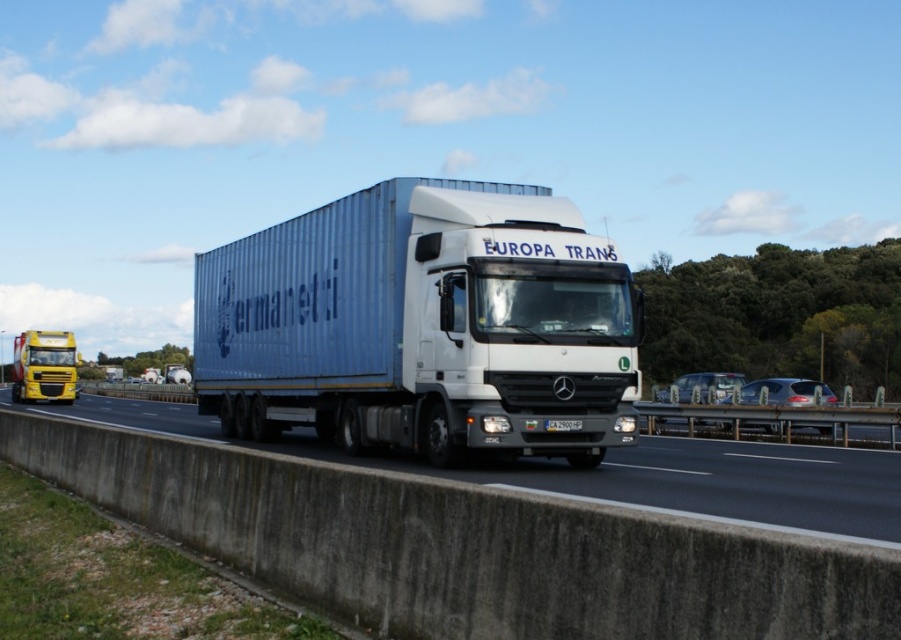
You are a driver approaching the highway and see the white glossy trailer truck at center and the metallic yellow truck at left. Which vehicle is positioned more to the right side of the highway?

The white glossy trailer truck at center is positioned more to the right side of the highway than the metallic yellow truck at left.

From the picture: You are standing on the highway and see two points marked on the road ahead. The first point is at coordinates point [302,448] and the second is at point [17,396]. Which point is closer to you?

Point [302,448] is closer to the camera than point [17,396], so the first point is closer to you.

You are a drone operator trying to capture the white Mercedes Benz truck with a blue trailer in the highway scene. You have two points marked on your screen for positioning your drone. The first point is at point (633, 294) and the second is at point (137, 424). Which point would give you a better view of the truck?

Point (633, 294) is closer to the viewer than point (137, 424), so positioning the drone at point (633, 294) would provide a better view of the truck.